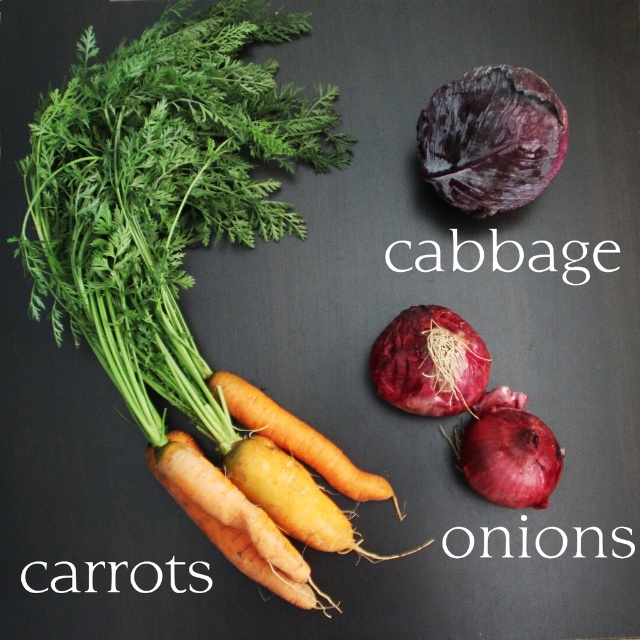
You are arranging vegetables on a table and need to place a bowl in between the orange smooth carrots at lower left and the orange matte carrots at center. Based on their positions, where should you place the bowl?

The bowl should be placed between the orange smooth carrots at lower left and the orange matte carrots at center, as the orange smooth carrots at lower left is in front of the orange matte carrots at center, creating a space between them.

You are looking at the arrangement of vegetables on the table. There are two points marked on the image, point 1 at coordinates point (x=438, y=157) and point 2 at coordinates point (x=460, y=401). Which point is closer to you?

Point (x=438, y=157) is further to the camera than point (x=460, y=401). Therefore, point (x=460, y=401) is closer to you.